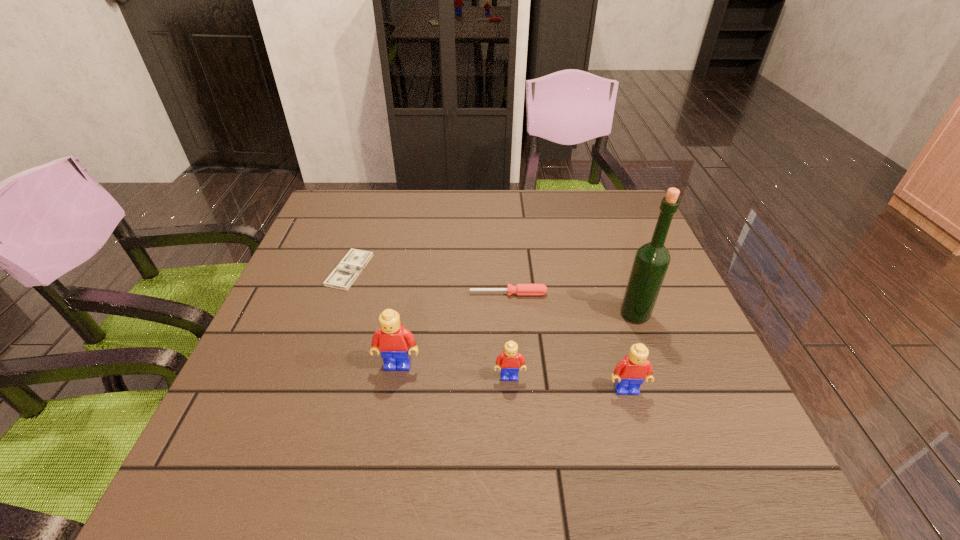
Observe the arrangement of all Legos in the image. To keep them evenly spaced, where would you place another Lego on the left? Please locate a free space. Please provide its 2D coordinates. Your answer should be formatted as a tuple, i.e. [(x, y)], where the tuple contains the x and y coordinates of a point satisfying the conditions above.

[(293, 353)]